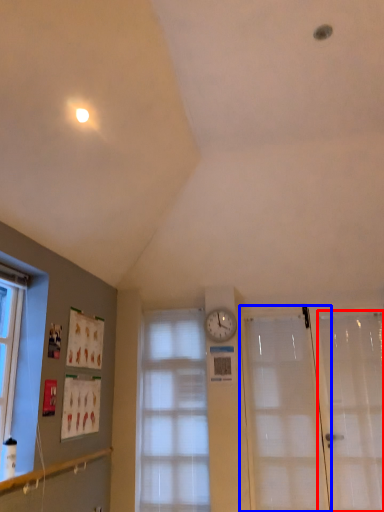
Question: Among these objects, which one is nearest to the camera, screen door (highlighted by a red box) or door (highlighted by a blue box)?

Choices:
 (A) screen door
 (B) door

Answer: (A)